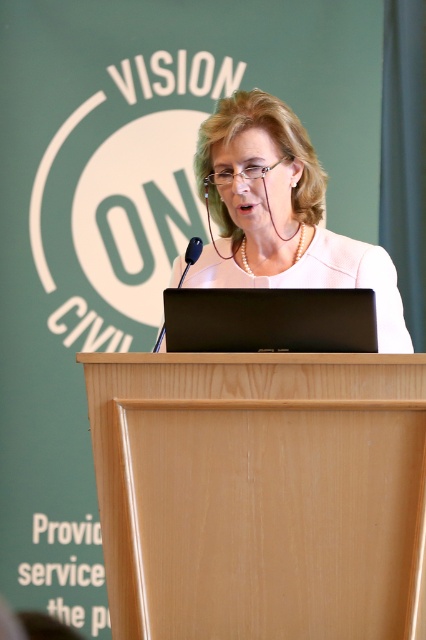
You are a photographer trying to capture the woman speaking at the podium. You notice two points in the scene marked as point 1 and point 2. Point 1 is at coordinate (267, 250) and point 2 is at (334, 340). Which point is closer to your camera lens?

Point 1 at coordinate (267, 250) is further to the camera than point 2 at (334, 340), so point 2 is closer to the camera lens.

You are an event organizer who needs to adjust the camera angle to capture both the light wood podium at center and the white textured blazer at center clearly. Based on their positions, which object should be framed first in the camera view?

The light wood podium at center should be framed first in the camera view since it is in front of the white textured blazer at center, ensuring both are visible without obstruction.